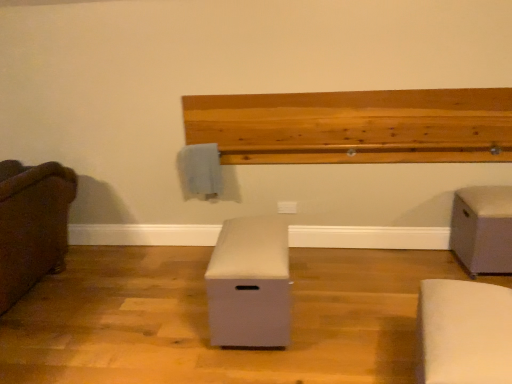
Question: Is brown fabric couch at left, marked as the 1th furniture in a left-to-right arrangement, oriented towards natural wood ledge at upper center?

Choices:
 (A) yes
 (B) no

Answer: (B)

Question: Is brown fabric couch at left, arranged as the fourth furniture when viewed from the right, surrounding natural wood ledge at upper center?

Choices:
 (A) no
 (B) yes

Answer: (A)

Question: Can you confirm if brown fabric couch at left, arranged as the fourth furniture when viewed from the right, is taller than natural wood ledge at upper center?

Choices:
 (A) no
 (B) yes

Answer: (B)

Question: Considering the relative sizes of brown fabric couch at left, arranged as the fourth furniture when viewed from the right, and natural wood ledge at upper center in the image provided, is brown fabric couch at left, arranged as the fourth furniture when viewed from the right, wider than natural wood ledge at upper center?

Choices:
 (A) no
 (B) yes

Answer: (B)

Question: From a real-world perspective, is brown fabric couch at left, marked as the 1th furniture in a left-to-right arrangement, physically below natural wood ledge at upper center?

Choices:
 (A) no
 (B) yes

Answer: (B)

Question: Is white fabric ottoman at lower right, acting as the 2th furniture starting from the right, not within brown fabric couch at left, arranged as the fourth furniture when viewed from the right?

Choices:
 (A) no
 (B) yes

Answer: (B)

Question: Considering the relative positions of white fabric ottoman at lower right, which appears as the third furniture when viewed from the left, and brown fabric couch at left, arranged as the fourth furniture when viewed from the right, in the image provided, is white fabric ottoman at lower right, which appears as the third furniture when viewed from the left, to the right of brown fabric couch at left, arranged as the fourth furniture when viewed from the right, from the viewer's perspective?

Choices:
 (A) no
 (B) yes

Answer: (B)

Question: Does white fabric ottoman at lower right, which appears as the third furniture when viewed from the left, have a greater width compared to brown fabric couch at left, marked as the 1th furniture in a left-to-right arrangement?

Choices:
 (A) no
 (B) yes

Answer: (A)

Question: From a real-world perspective, is white fabric ottoman at lower right, acting as the 2th furniture starting from the right, located higher than brown fabric couch at left, marked as the 1th furniture in a left-to-right arrangement?

Choices:
 (A) no
 (B) yes

Answer: (A)

Question: Is white fabric ottoman at lower right, acting as the 2th furniture starting from the right, taller than brown fabric couch at left, marked as the 1th furniture in a left-to-right arrangement?

Choices:
 (A) no
 (B) yes

Answer: (A)

Question: From the image's perspective, is white fabric ottoman at lower right, acting as the 2th furniture starting from the right, under brown fabric couch at left, marked as the 1th furniture in a left-to-right arrangement?

Choices:
 (A) no
 (B) yes

Answer: (B)

Question: Is beige fabric ottoman at right, acting as the first furniture starting from the right, smaller than white fabric ottoman at lower right, which appears as the third furniture when viewed from the left?

Choices:
 (A) yes
 (B) no

Answer: (A)